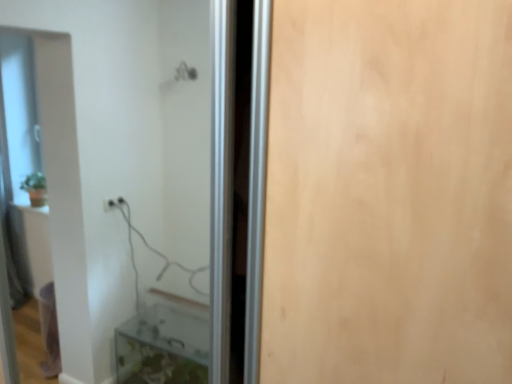
Describe the element at coordinates (389, 193) in the screenshot. Image resolution: width=512 pixels, height=384 pixels. I see `wooden door at right` at that location.

Where is `wooden door at right`? wooden door at right is located at coordinates (389, 193).

Image resolution: width=512 pixels, height=384 pixels. I want to click on wooden door at right, so click(389, 193).